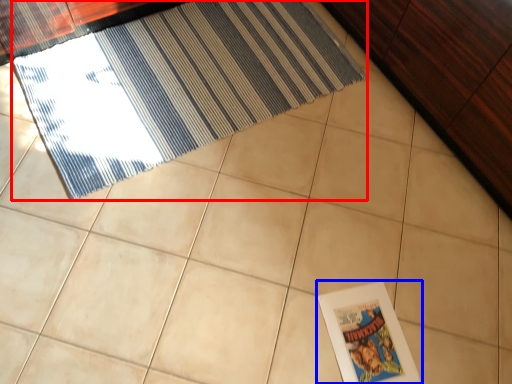
Question: Which object appears farthest to the camera in this image, door (highlighted by a red box) or picture frame (highlighted by a blue box)?

Choices:
 (A) door
 (B) picture frame

Answer: (A)